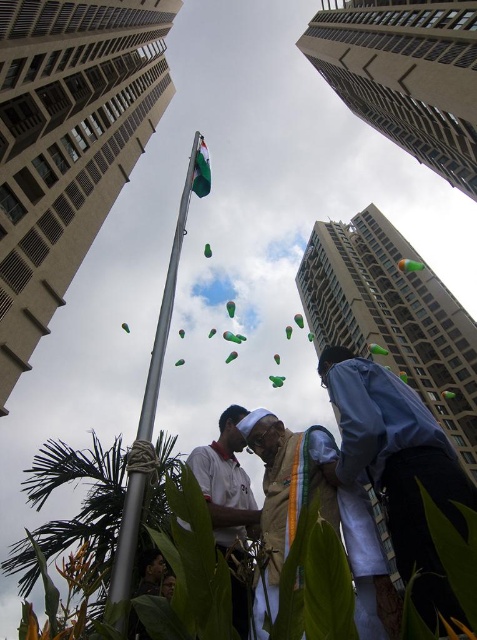
You are a photographer standing at the base of the flagpole. You want to take a photo that includes both the blue fabric shirt at lower right and the light brown fabric at center. Which object should you focus on first to ensure both are in the frame?

You should focus on the light brown fabric at center first because the blue fabric shirt at lower right is in front of it, so adjusting the framing to include the foreground object will naturally include the background one as well.

You are a photographer standing at the base of the flagpole. You want to capture a photo that includes both the blue fabric shirt at lower right and the white matte shirt at center. Considering their sizes, which shirt will appear wider in the photo?

The blue fabric shirt at lower right will appear wider in the photo because its width is larger than the white matte shirt at center.